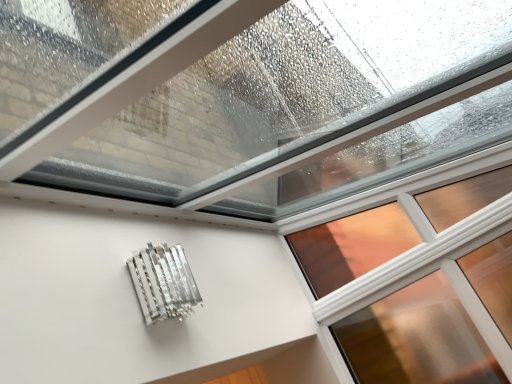
Question: Is metallic silver at lower left inside or outside of clear glass window at upper center?

Choices:
 (A) outside
 (B) inside

Answer: (A)

Question: From the image's perspective, is metallic silver at lower left located above or below clear glass window at upper center?

Choices:
 (A) below
 (B) above

Answer: (A)

Question: From a real-world perspective, is metallic silver at lower left physically located above or below clear glass window at upper center?

Choices:
 (A) above
 (B) below

Answer: (A)

Question: Considering the positions of clear glass window at upper center and metallic silver at lower left in the image, is clear glass window at upper center wider or thinner than metallic silver at lower left?

Choices:
 (A) wide
 (B) thin

Answer: (B)

Question: Is clear glass window at upper center inside or outside of metallic silver at lower left?

Choices:
 (A) inside
 (B) outside

Answer: (B)

Question: Visually, is clear glass window at upper center positioned to the left or to the right of metallic silver at lower left?

Choices:
 (A) right
 (B) left

Answer: (A)

Question: From a real-world perspective, is clear glass window at upper center above or below metallic silver at lower left?

Choices:
 (A) below
 (B) above

Answer: (A)